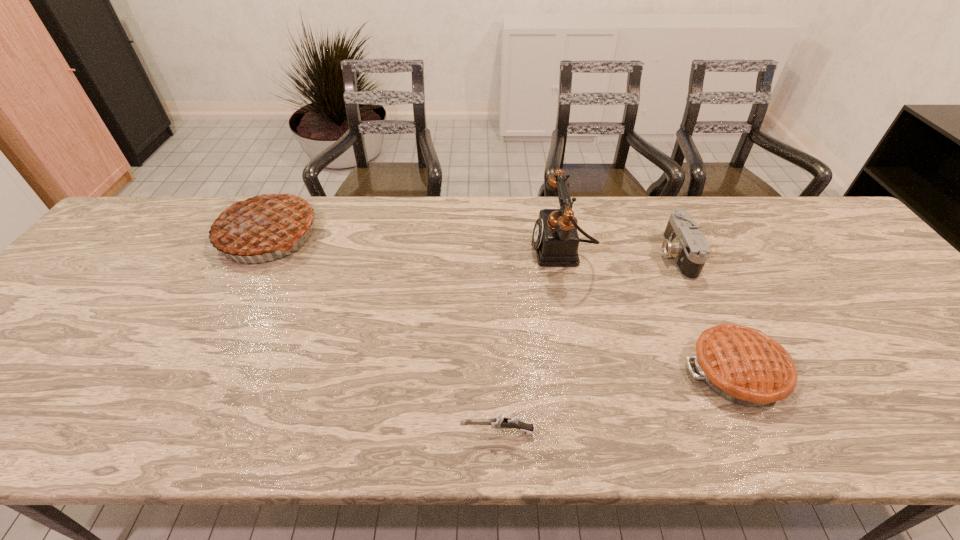
Where is `free space in the image that satisfies the following two spatial constraints: 1. on the lens of the nearer pie; 2. on the left side of the camera`? free space in the image that satisfies the following two spatial constraints: 1. on the lens of the nearer pie; 2. on the left side of the camera is located at coordinates (731, 372).

I want to click on vacant point that satisfies the following two spatial constraints: 1. on the front of the nearer pie at the rotary dial; 2. on the right side of the third object from right to left, so click(585, 372).

Find the location of a particular element. Image resolution: width=960 pixels, height=540 pixels. free space that satisfies the following two spatial constraints: 1. on the front of the nearer pie at the rotary dial; 2. on the left side of the third object from left to right is located at coordinates (585, 372).

The height and width of the screenshot is (540, 960). I want to click on free region that satisfies the following two spatial constraints: 1. on the lens of the shorter pie; 2. on the right side of the camera, so point(731,372).

Locate an element on the screen. The image size is (960, 540). vacant area in the image that satisfies the following two spatial constraints: 1. on the lens of the camera; 2. on the right side of the nearer pie is located at coordinates (731, 372).

Locate an element on the screen. free region that satisfies the following two spatial constraints: 1. on the back side of the shorter pie; 2. on the front of the third object from right to left at the rotary dial is located at coordinates (679, 249).

The height and width of the screenshot is (540, 960). I want to click on free space that satisfies the following two spatial constraints: 1. on the front of the right pie at the rotary dial; 2. on the right side of the telephone, so click(585, 372).

In order to click on free location that satisfies the following two spatial constraints: 1. on the lens of the camera; 2. on the right side of the second nearest object in this screenshot , I will do `click(731, 372)`.

At what (x,y) coordinates should I click in order to perform the action: click on free spot that satisfies the following two spatial constraints: 1. on the front of the third object from right to left at the rotary dial; 2. on the left side of the nearer pie. Please return your answer as a coordinate pair (x, y). Image resolution: width=960 pixels, height=540 pixels. Looking at the image, I should click on (585, 372).